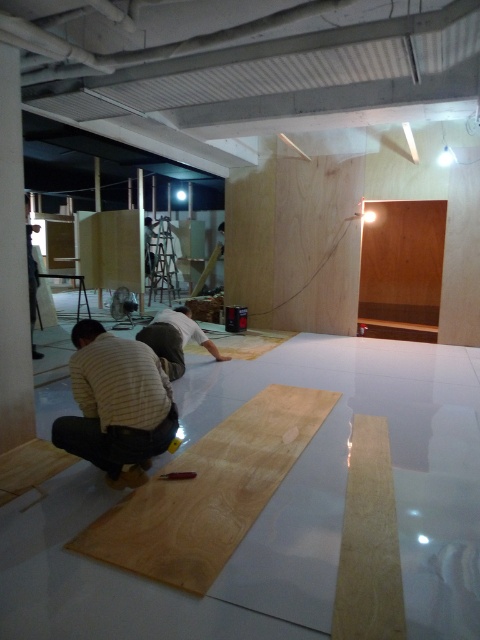
You are standing in the workspace and see two points marked in the image. Which point, point (147,572) or point (393,493), is closer to you?

Point (147,572) is closer to you than point (393,493).

You are standing at the entrance of the workspace and want to place a new tool on the light wood plank at center. Based on its coordinates, where exactly should you aim to place the tool?

The light wood plank at center is located at coordinates point (369,541), so you should aim for that exact point to place the tool.

In the scene shown: You are standing at the entrance of the workspace and need to place a new tool box near the natural wood plywood at lower left. According to the coordinates provided, where should you position the tool box?

The natural wood plywood at lower left is located at point (208,492), so you should position the tool box near that coordinate.